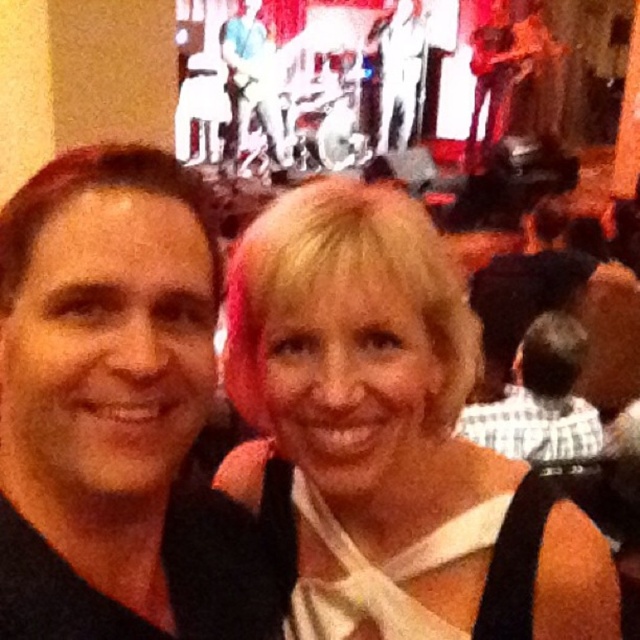
Question: Does black matte hair at center appear under white checkered shirt at center?

Choices:
 (A) no
 (B) yes

Answer: (A)

Question: Can you confirm if blonde hair at center is bigger than white checkered shirt at center?

Choices:
 (A) yes
 (B) no

Answer: (B)

Question: Is blonde hair at center to the left of black matte hair at center from the viewer's perspective?

Choices:
 (A) no
 (B) yes

Answer: (A)

Question: Which object appears closest to the camera in this image?

Choices:
 (A) white checkered shirt at center
 (B) black matte hair at center

Answer: (B)

Question: Which object is farther from the camera taking this photo?

Choices:
 (A) black matte hair at center
 (B) blonde hair at center
 (C) white checkered shirt at center

Answer: (C)

Question: Which object is positioned farthest from the white checkered shirt at center?

Choices:
 (A) blonde hair at center
 (B) black matte hair at center

Answer: (B)